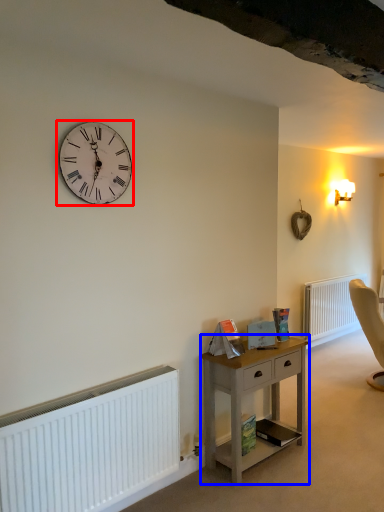
Question: Which of the following is the farthest to the observer, wall clock (highlighted by a red box) or nightstand (highlighted by a blue box)?

Choices:
 (A) wall clock
 (B) nightstand

Answer: (B)